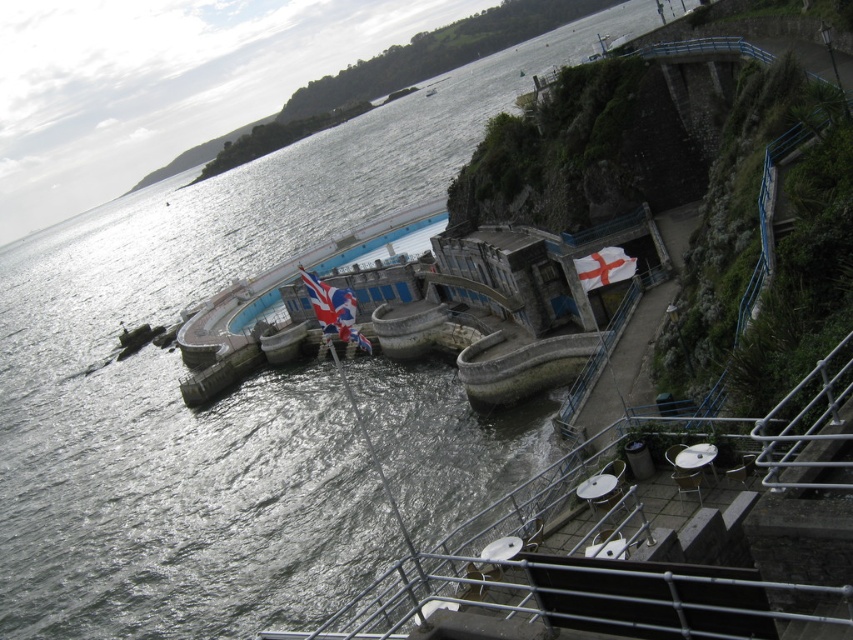
Question: Which is nearer to the blue concrete pool at center?

Choices:
 (A) white fabric flag at upper right
 (B) union jack fabric flag at center

Answer: (B)

Question: Which point appears farthest from the camera in this image?

Choices:
 (A) (631, 268)
 (B) (350, 298)

Answer: (A)

Question: Can you confirm if blue concrete pool at center is positioned to the left of union jack fabric flag at center?

Choices:
 (A) yes
 (B) no

Answer: (A)

Question: Can you confirm if blue concrete pool at center is positioned below white fabric flag at upper right?

Choices:
 (A) no
 (B) yes

Answer: (A)

Question: Which object is farther from the camera taking this photo?

Choices:
 (A) union jack fabric flag at center
 (B) white fabric flag at upper right

Answer: (B)

Question: Can you confirm if blue concrete pool at center is smaller than union jack fabric flag at center?

Choices:
 (A) no
 (B) yes

Answer: (B)